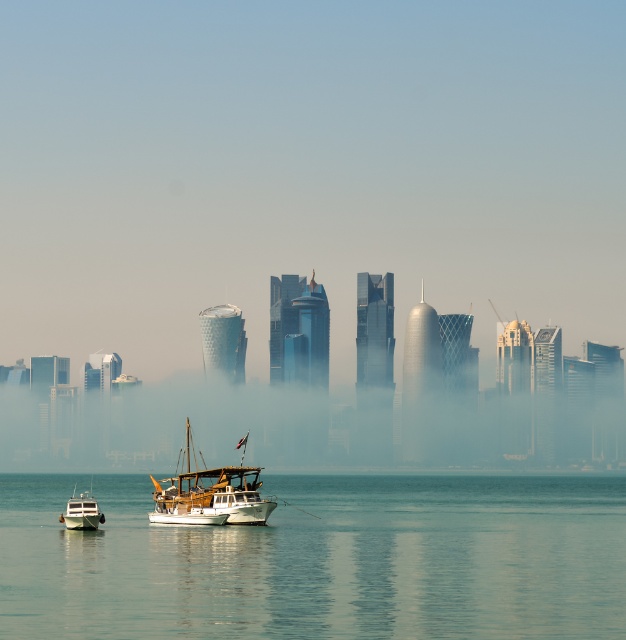
You are a photographer positioned at the lower left corner of the waterfront scene. You want to capture both the wooden sailboat at center and the white wooden boat at lower left in a single shot. Which boat should you adjust your camera angle towards to include both in the frame?

The wooden sailboat at center is to the right of the white wooden boat at lower left, so you should adjust your camera angle towards the right to include both boats in the frame.